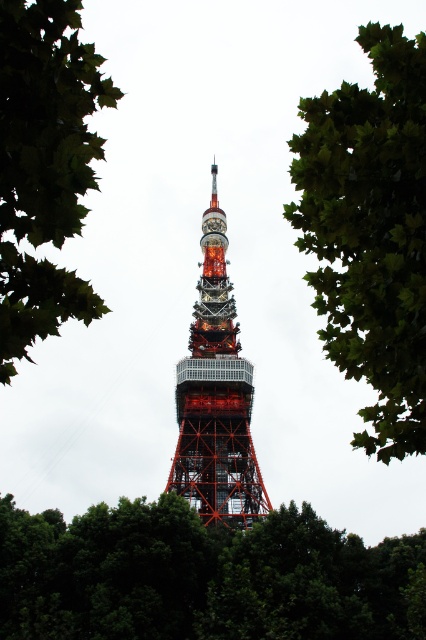
You are standing in a park and see the green leafy tree at upper center and the shiny metallic tower at center. Which object is higher up in the scene?

The green leafy tree at upper center is positioned over the shiny metallic tower at center, meaning it is higher up in the scene.

You are standing in a park and see the green leafy tree at upper center and the shiny metallic tower at center. Which object is closer to you?

The green leafy tree at upper center is closer to the viewer than the shiny metallic tower at center.

You are a photographer planning to capture the shiny metallic tower at center through the branches of the green leafy tree at upper left. Given their sizes in the frame, will the tree block most of the tower?

The green leafy tree at upper left occupies less space than the shiny metallic tower at center, so it will not block most of the tower.